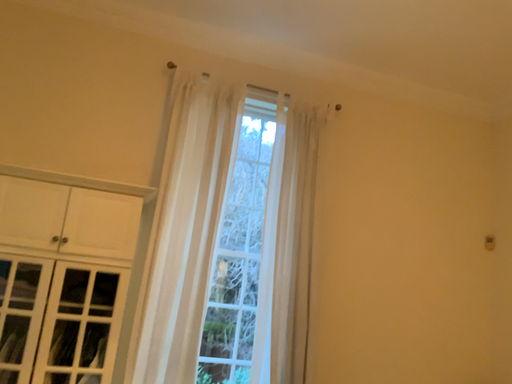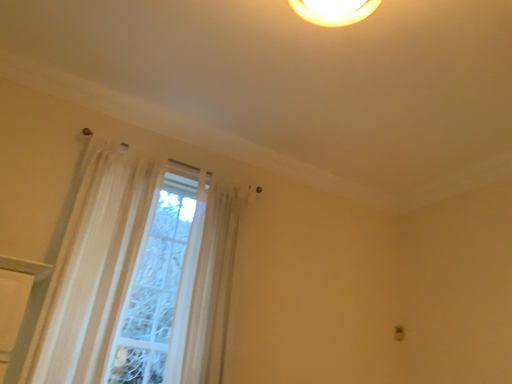
Question: Which way did the camera rotate in the video?

Choices:
 (A) rotated right
 (B) rotated left

Answer: (A)